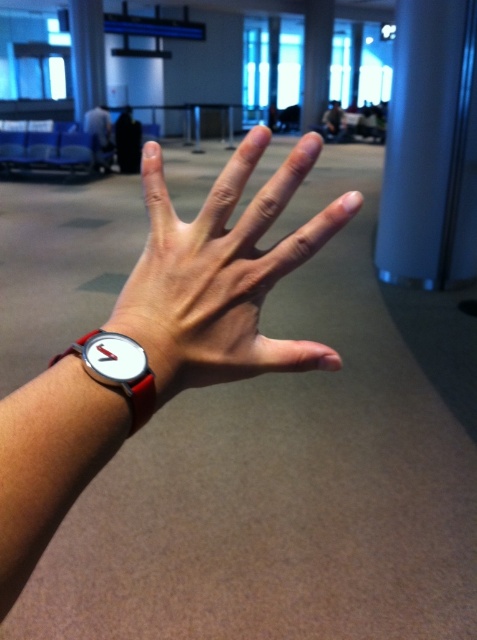
Who is lower down, white leather watch at center or white matte watch at center?

white leather watch at center is below.

Which is in front, point (165, 380) or point (124, 305)?

Point (165, 380) is more forward.

Which is behind, point (41, 502) or point (261, 250)?

Positioned behind is point (261, 250).

Locate an element on the screen. This screenshot has height=640, width=477. white leather watch at center is located at coordinates (221, 273).

Is satin blue pillar at right thinner than matte black watch at lower left?

No, satin blue pillar at right is not thinner than matte black watch at lower left.

This screenshot has width=477, height=640. Identify the location of satin blue pillar at right. (431, 148).

Who is more distant from viewer, (x=405, y=83) or (x=92, y=131)?

The point (x=92, y=131) is behind.

Locate an element on the screen. The height and width of the screenshot is (640, 477). satin blue pillar at right is located at coordinates (431, 148).

Between white matte watch at center and matte black watch at lower left, which one is positioned higher?

matte black watch at lower left is above.

Which of these two, white matte watch at center or matte black watch at lower left, stands taller?

matte black watch at lower left

You are a GUI agent. You are given a task and a screenshot of the screen. Output one action in this format:
    pyautogui.click(x=<x>, y=<y>)
    Task: Click on the white matte watch at center
    
    Given the screenshot: What is the action you would take?
    pyautogui.click(x=223, y=273)